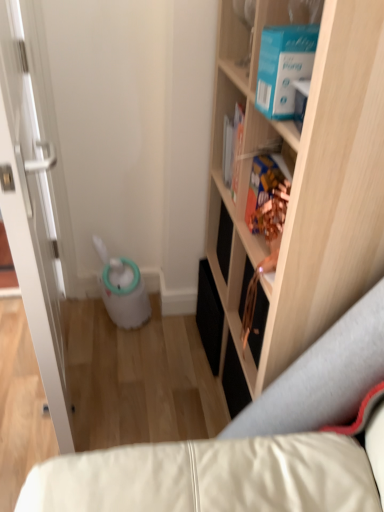
Measure the distance between white glossy door at left and camera.

white glossy door at left is 31.03 inches away from camera.

Identify the location of light wood cabinet at upper right. (302, 190).

You are a GUI agent. You are given a task and a screenshot of the screen. Output one action in this format:
    pyautogui.click(x=<x>, y=<y>)
    Task: Click on the white glossy door at left
    
    Given the screenshot: What is the action you would take?
    34,197

From the picture: Is multicolored cardboard book at upper right oriented away from white glossy door at left?

No, white glossy door at left is not at the back of multicolored cardboard book at upper right.

Considering the relative sizes of multicolored cardboard book at upper right and white glossy door at left in the image provided, is multicolored cardboard book at upper right taller than white glossy door at left?

In fact, multicolored cardboard book at upper right may be shorter than white glossy door at left.

Is multicolored cardboard book at upper right in contact with white glossy door at left?

No, multicolored cardboard book at upper right is not with white glossy door at left.

From the image's perspective, does multicolored cardboard book at upper right appear lower than white glossy door at left?

No, from the image's perspective, multicolored cardboard book at upper right is not below white glossy door at left.

This screenshot has width=384, height=512. I want to click on door that is behind the light wood cabinet at upper right, so click(x=34, y=197).

Considering the relative positions of white glossy door at left and light wood cabinet at upper right in the image provided, is white glossy door at left to the left of light wood cabinet at upper right from the viewer's perspective?

Yes, white glossy door at left is to the left of light wood cabinet at upper right.

Could you tell me if white glossy door at left is facing light wood cabinet at upper right?

No, white glossy door at left is not aimed at light wood cabinet at upper right.

Which point is more forward, (24, 183) or (358, 226)?

The point (358, 226) is closer to the camera.

Which is behind, point (33, 290) or point (280, 206)?

The point (280, 206) is farther from the camera.

Looking at this image, are white glossy door at left and multicolored cardboard book at upper right making contact?

white glossy door at left is not next to multicolored cardboard book at upper right, and they're not touching.

Between white glossy door at left and multicolored cardboard book at upper right, which one is positioned in front?

Positioned in front is white glossy door at left.

Is white glossy door at left oriented away from multicolored cardboard book at upper right?

Yes, multicolored cardboard book at upper right is at the back of white glossy door at left.

Would you say multicolored cardboard book at upper right is outside light wood cabinet at upper right?

No, multicolored cardboard book at upper right is not outside of light wood cabinet at upper right.

From the image's perspective, is multicolored cardboard book at upper right located beneath light wood cabinet at upper right?

Incorrect, from the image's perspective, multicolored cardboard book at upper right is higher than light wood cabinet at upper right.

Based on the photo, considering the sizes of multicolored cardboard book at upper right and light wood cabinet at upper right in the image, is multicolored cardboard book at upper right bigger or smaller than light wood cabinet at upper right?

Clearly, multicolored cardboard book at upper right is smaller in size than light wood cabinet at upper right.

Who is shorter, multicolored cardboard book at upper right or light wood cabinet at upper right?

multicolored cardboard book at upper right is shorter.

Can we say light wood cabinet at upper right lies outside multicolored cardboard book at upper right?

Yes.

Find the location of `cabinetry in front of the multicolored cardboard book at upper right`. cabinetry in front of the multicolored cardboard book at upper right is located at coordinates (302, 190).

Which is further, (264,132) or (32,307)?

The point (264,132) is more distant.

Is light wood cabinet at upper right oriented away from white glossy door at left?

light wood cabinet at upper right does not have its back to white glossy door at left.

Considering the relative positions of light wood cabinet at upper right and white glossy door at left in the image provided, is light wood cabinet at upper right behind white glossy door at left?

No, it is not.

From the image's perspective, who appears lower, light wood cabinet at upper right or white glossy door at left?

light wood cabinet at upper right appears lower in the image.

Locate an element on the screen. door below the multicolored cardboard book at upper right (from the image's perspective) is located at coordinates (34, 197).

Find the location of a particular element. Image resolution: width=384 pixels, height=512 pixels. door below the light wood cabinet at upper right (from a real-world perspective) is located at coordinates (34, 197).

Based on the photo, estimate the real-world distances between objects in this image. Which object is closer to multicolored cardboard book at upper right, light wood cabinet at upper right or white glossy door at left?

Among the two, light wood cabinet at upper right is located nearer to multicolored cardboard book at upper right.

From the image, which object appears to be farther from light wood cabinet at upper right, multicolored cardboard book at upper right or white glossy door at left?

The object further to light wood cabinet at upper right is white glossy door at left.

Estimate the real-world distances between objects in this image. Which object is closer to white glossy door at left, multicolored cardboard book at upper right or light wood cabinet at upper right?

The object closer to white glossy door at left is light wood cabinet at upper right.

Considering their positions, is white glossy door at left positioned closer to light wood cabinet at upper right than multicolored cardboard book at upper right?

multicolored cardboard book at upper right is closer to light wood cabinet at upper right.

Which object lies further to the anchor point multicolored cardboard book at upper right, white glossy door at left or light wood cabinet at upper right?

Among the two, white glossy door at left is located further to multicolored cardboard book at upper right.

Which object lies further to the anchor point white glossy door at left, light wood cabinet at upper right or multicolored cardboard book at upper right?

multicolored cardboard book at upper right is further to white glossy door at left.

The height and width of the screenshot is (512, 384). I want to click on book located between white glossy door at left and light wood cabinet at upper right in the left-right direction, so click(x=267, y=198).